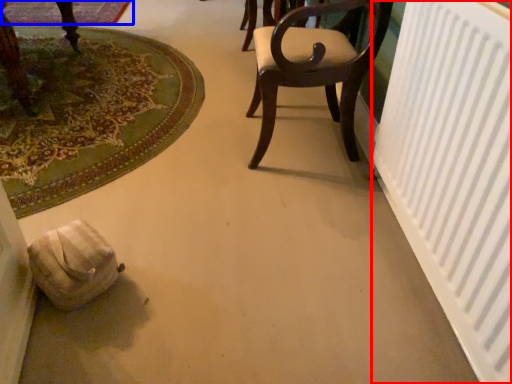
Question: Which object appears farthest to the camera in this image, radiator (highlighted by a red box) or mat (highlighted by a blue box)?

Choices:
 (A) radiator
 (B) mat

Answer: (B)